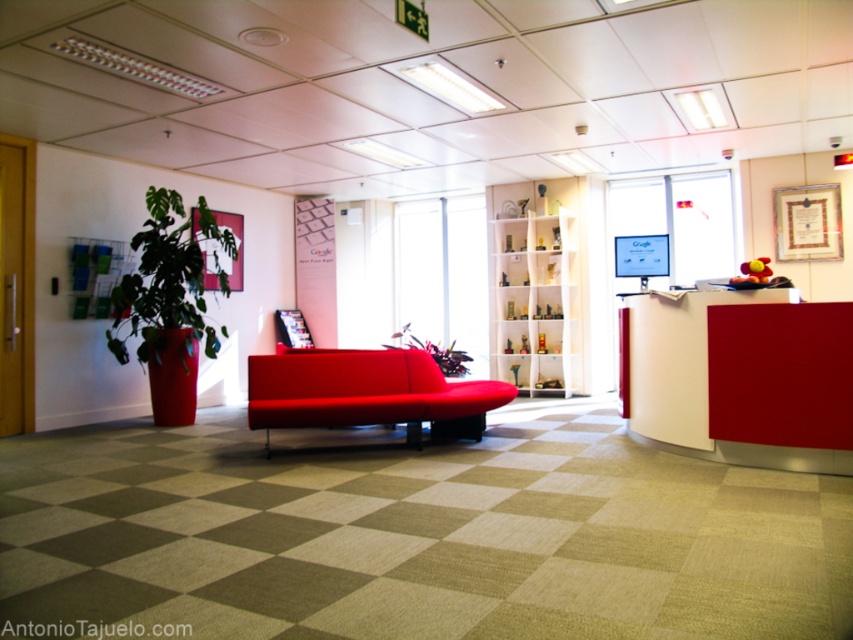
Question: Which of the following is the closest to the observer?

Choices:
 (A) (381, 346)
 (B) (253, 424)

Answer: (B)

Question: Does green matte plant at left appear on the right side of green matte plant at center?

Choices:
 (A) no
 (B) yes

Answer: (A)

Question: Which point is closer to the camera taking this photo?

Choices:
 (A) (178, 316)
 (B) (401, 326)

Answer: (A)

Question: Considering the real-world distances, which object is farthest from the green matte plant at center?

Choices:
 (A) green matte plant at left
 (B) matte red couch at center

Answer: (B)

Question: Considering the relative positions of matte red couch at center and green matte plant at left in the image provided, where is matte red couch at center located with respect to green matte plant at left?

Choices:
 (A) below
 (B) above

Answer: (A)

Question: Does green matte plant at left appear over green matte plant at center?

Choices:
 (A) yes
 (B) no

Answer: (A)